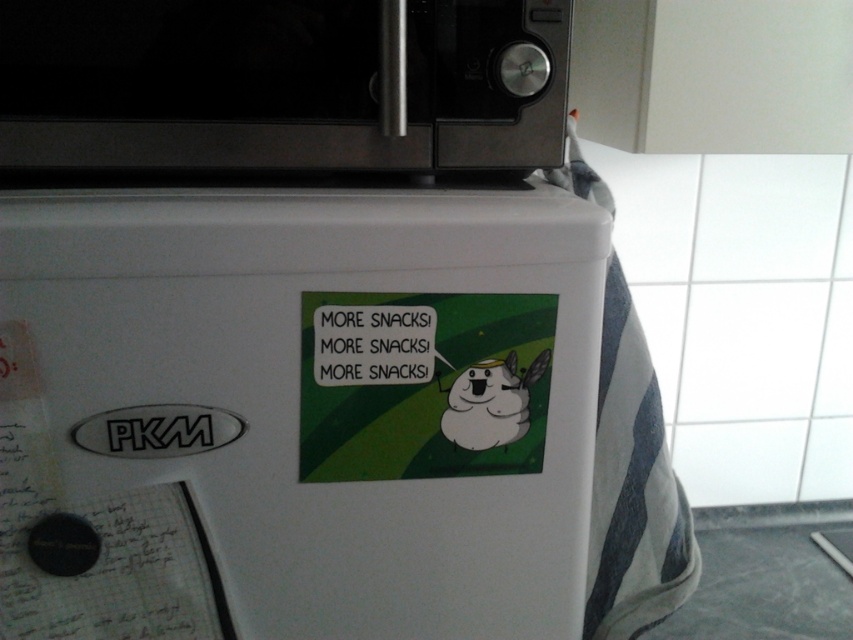
You are a delivery person who needs to place a new microwave on top of the refrigerator. The new microwave is the same size as the black matte microwave at upper center. Can you safely place it there without covering the green matte sticker at center?

The black matte microwave at upper center has a greater height compared to green matte sticker at center, so placing a new microwave of the same height would likely cover the green matte sticker at center. Choose a different location to avoid covering the sticker.

You are trying to place a new decorative sticker on your refrigerator. The current sticker, green matte sticker at center, is smaller than the black matte microwave at upper center. Will the new sticker, which is the same size as the microwave, fit in the same area where the existing sticker is placed?

The black matte microwave at upper center is larger than the green matte sticker at center. Since the new sticker is the same size as the microwave, it will not fit in the area where the existing green matte sticker at center is placed because the existing area is smaller.